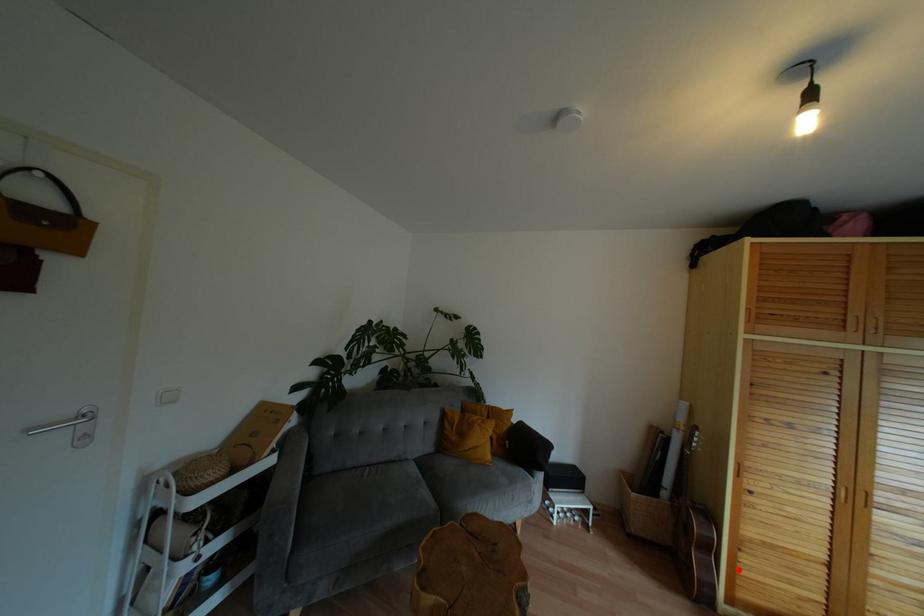
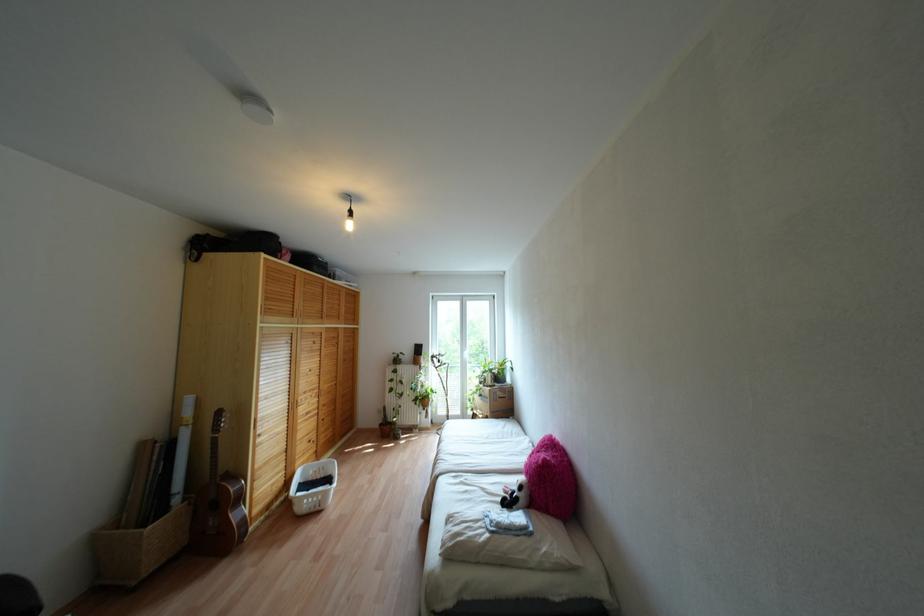
Question: I am providing you with two images of the same scene from different viewpoints. Given a red point in image1, look at the same physical point in image2. Is it:

Choices:
 (A) Closer to the viewpoint
 (B) Farther from the viewpoint

Answer: (B)